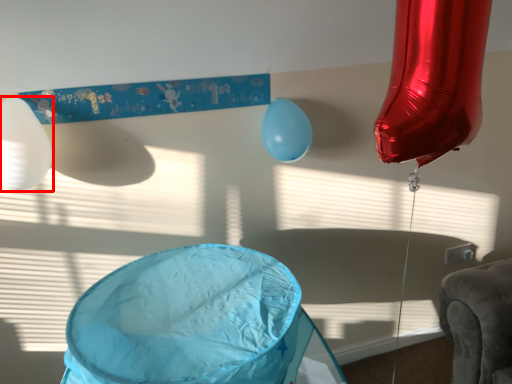
Question: In this image, where is balloon (annotated by the red box) located relative to balloon?

Choices:
 (A) right
 (B) left

Answer: (B)